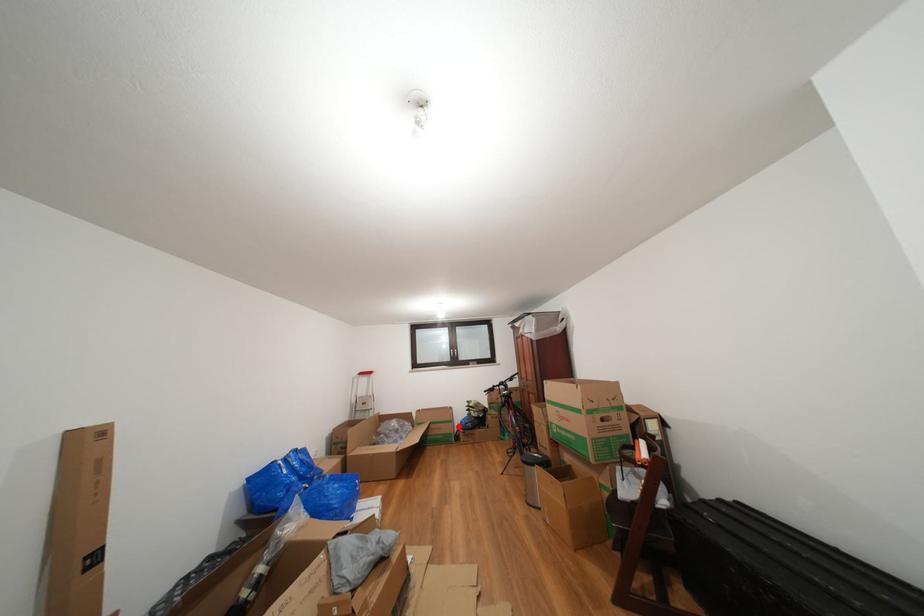
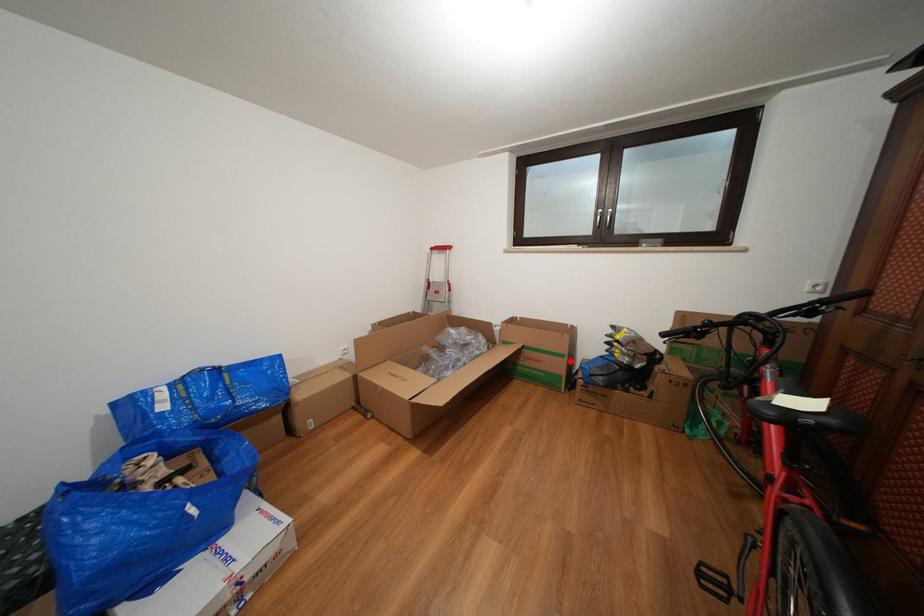
I am providing you with two images of the same scene from different viewpoints. A red point is marked on the first image and another point is marked on the second image. Do the highlighted points in image1 and image2 indicate the same real-world spot?

Yes